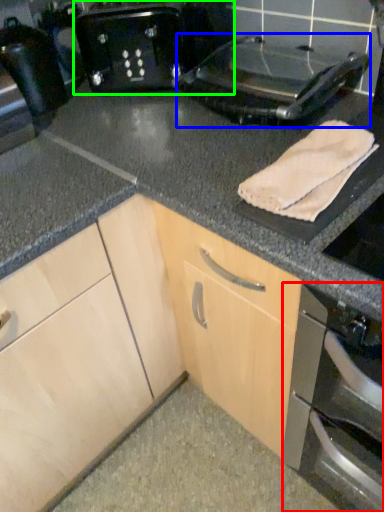
Question: Which is farther away from home appliance (highlighted by a red box)? kitchen appliance (highlighted by a blue box) or toaster (highlighted by a green box)?

Choices:
 (A) kitchen appliance
 (B) toaster

Answer: (B)